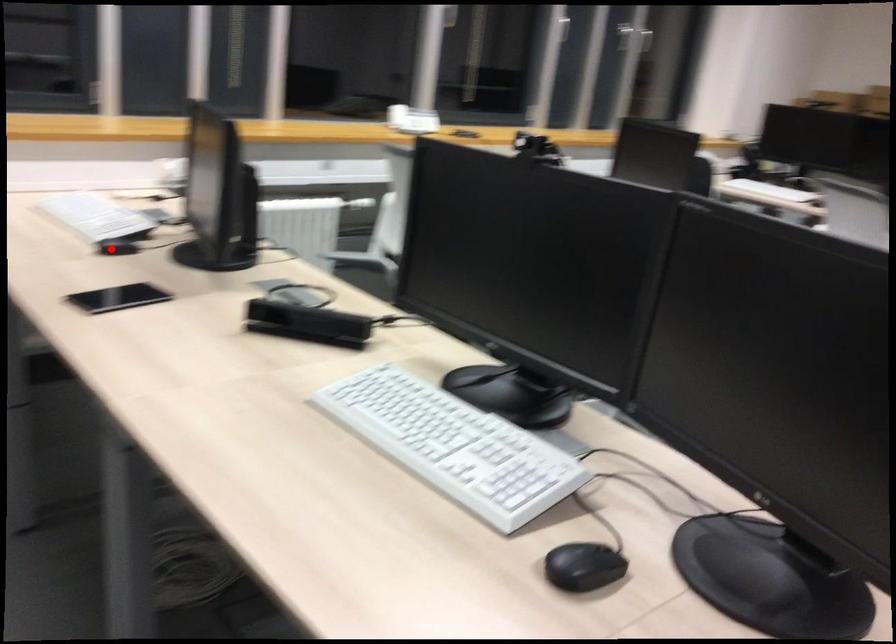
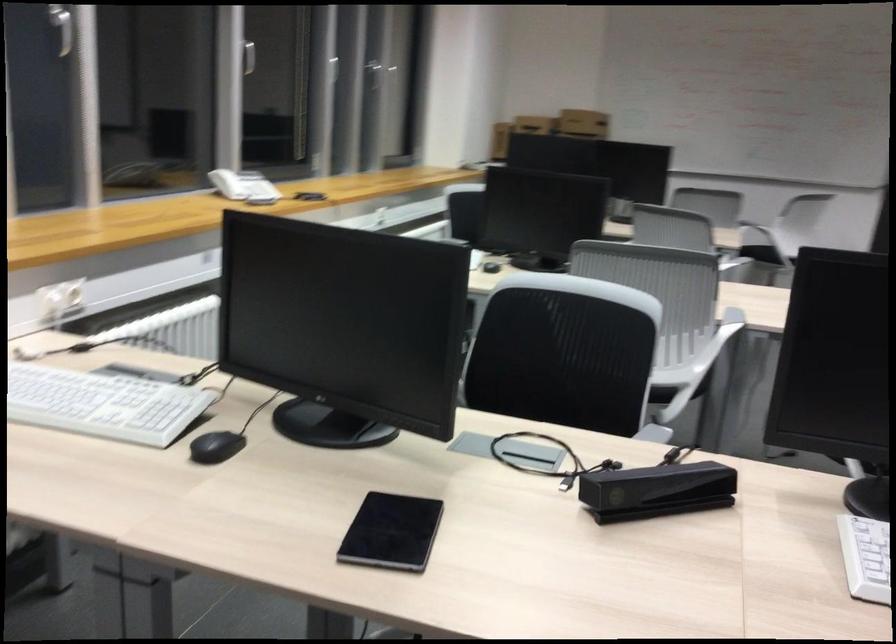
Question: A red point is marked in image1. In image2, is the corresponding 3D point closer to the camera or farther? Reply with the corresponding letter.

Choices:
 (A) The corresponding 3D point is closer.
 (B) The corresponding 3D point is farther.

Answer: (A)